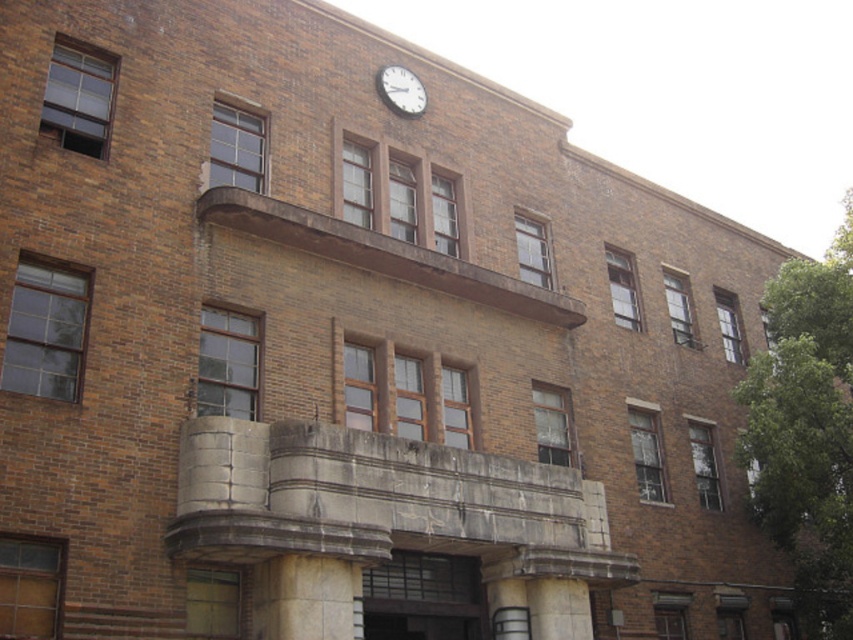
Question: Based on their relative distances, which object is nearer to the white matte clock at upper center?

Choices:
 (A) white concrete pillar at center
 (B) white marble pillar at center

Answer: (A)

Question: Is white concrete pillar at center to the right of white matte clock at upper center from the viewer's perspective?

Choices:
 (A) no
 (B) yes

Answer: (B)

Question: Does white marble pillar at center appear over white matte clock at upper center?

Choices:
 (A) yes
 (B) no

Answer: (B)

Question: Which of the following is the closest to the observer?

Choices:
 (A) white concrete pillar at center
 (B) white matte clock at upper center

Answer: (A)

Question: Which point is farther to the camera?

Choices:
 (A) white marble pillar at center
 (B) white matte clock at upper center

Answer: (B)

Question: Does white marble pillar at center appear under white matte clock at upper center?

Choices:
 (A) yes
 (B) no

Answer: (A)